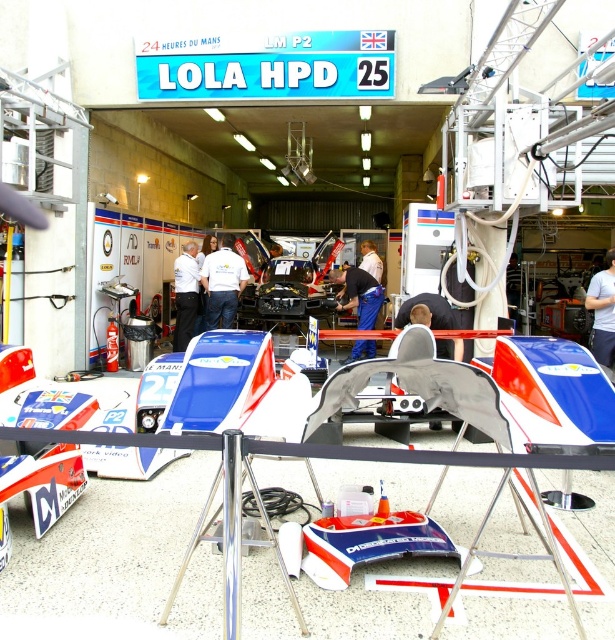
From the picture: You are a mechanic in the Lola HPD garage. You need to move a tool from the point at coordinate point at (231, 269) to another point in the garage. The distance between these two points is 10.36 meters. If your tool weighs 15 kilograms, and you can carry it for 10 meters before needing to rest, how many times will you need to rest during this trip?

The distance between the point at (231, 269) and the other point is 10.36 meters. Since you can carry the 15 kg tool for 10 meters before resting, you will need to rest once during the trip. After carrying it 10 meters, you have 0.36 meters remaining, requiring an additional rest. However, since 0.36 meters is less than 10 meters, you would rest once before completing the final short distance.

You are standing in the Lola HPD garage at the 24 Hours of Le Mans. You need to locate the blue fabric pants at center. Where exactly are they positioned in the garage?

The blue fabric pants at center are positioned at the coordinates point (359, 294) in the garage.

You are standing at the entrance of the Lola HPD garage and notice a white shirt at center. Where exactly is the white shirt located in relation to the entrance?

The white shirt at center is located at point (223, 282) relative to the entrance, which means it is positioned approximately 44.2 centimeters to the right and 36.3 centimeters forward from the entrance point.